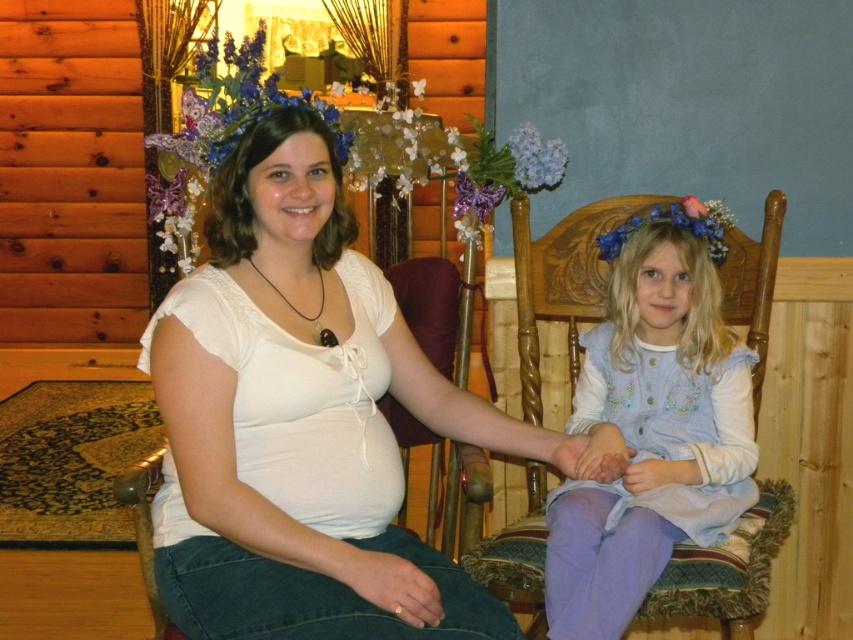
You are a photographer trying to capture the scene where the two subjects are holding hands. You need to ensure the white lace shirt at center and the light blue fabric dress at center are both visible in the frame. Which clothing item should you focus on first to ensure both are in the shot?

The white lace shirt at center is positioned on the left side of the light blue fabric dress at center, so you should focus on the light blue fabric dress at center first to ensure both are in the frame since it is on the right and the photographer can adjust the frame to include the left side as well.